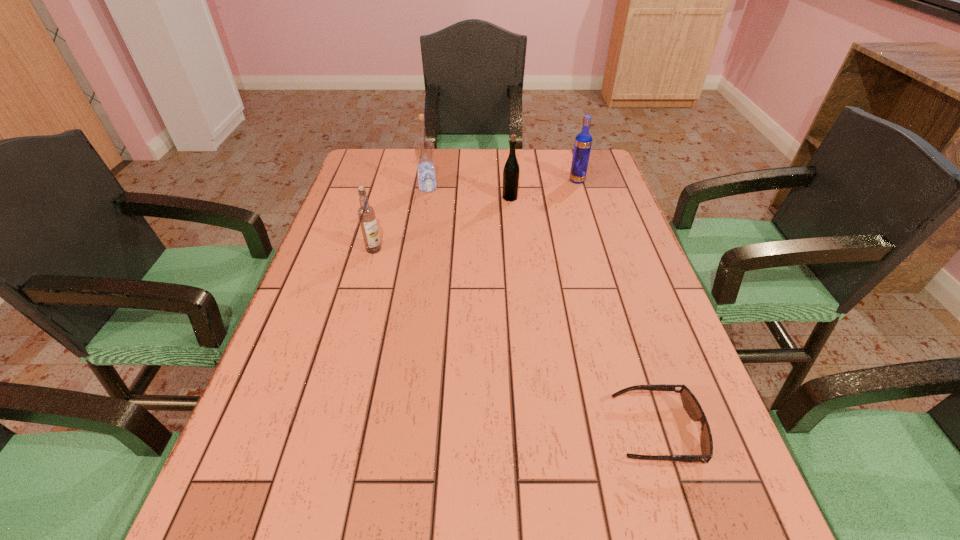
Where is `the second object from left to right`? This screenshot has height=540, width=960. the second object from left to right is located at coordinates (424, 148).

The image size is (960, 540). What are the coordinates of `the rightmost vodka` in the screenshot? It's located at (583, 141).

I want to click on the third object from left to right, so click(x=511, y=171).

What are the coordinates of `the third nearest object` in the screenshot? It's located at click(511, 171).

At what (x,y) coordinates should I click in order to perform the action: click on the leftmost vodka. Please return your answer as a coordinate pair (x, y). Looking at the image, I should click on point(366,213).

The width and height of the screenshot is (960, 540). Find the location of `the second nearest object`. the second nearest object is located at coordinates pos(366,213).

Image resolution: width=960 pixels, height=540 pixels. Identify the location of the shortest object. (690, 403).

Find the location of a particular element. This screenshot has width=960, height=540. sunglasses is located at coordinates (690, 403).

Locate an element on the screen. free spot located 0.050m on the right of the second vodka from right to left is located at coordinates (453, 188).

The image size is (960, 540). What are the coordinates of `vacant space located 0.280m on the left of the rightmost vodka` in the screenshot? It's located at (482, 181).